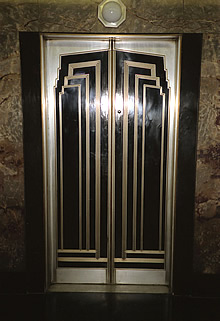
Find the location of a particular element. The width and height of the screenshot is (220, 321). black glossy floor is located at coordinates (x=90, y=309).